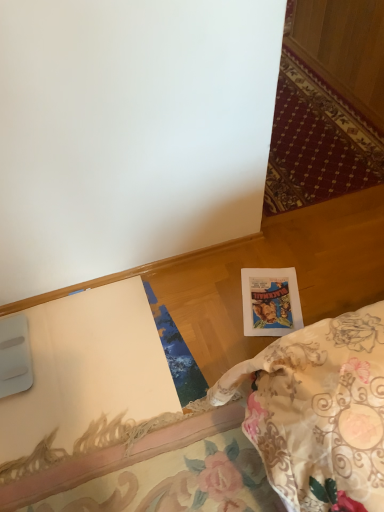
This screenshot has height=512, width=384. Identify the location of free point above printed paper postcard at lower right (from a real-world perspective). (285, 306).